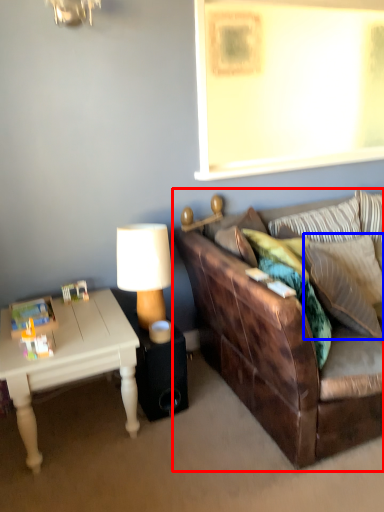
Question: Among these objects, which one is nearest to the camera, studio couch (highlighted by a red box) or pillow (highlighted by a blue box)?

Choices:
 (A) studio couch
 (B) pillow

Answer: (A)